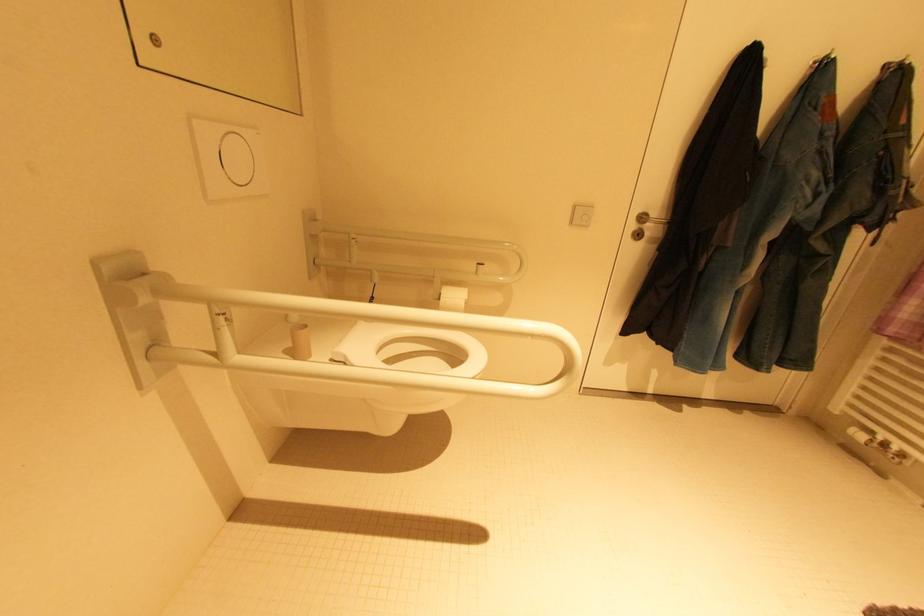
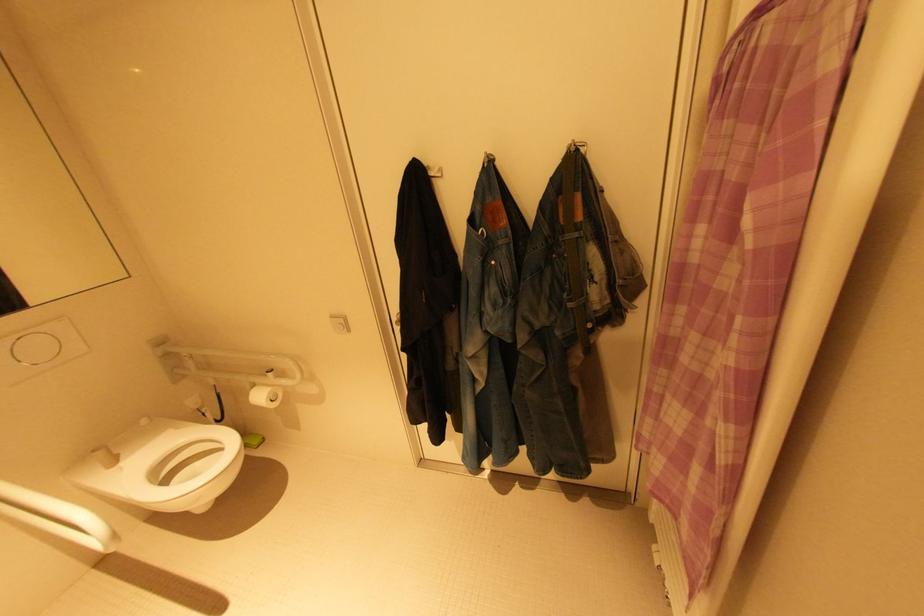
Question: The images are taken continuously from a first-person perspective. In which direction are you moving?

Choices:
 (A) Left
 (B) Right
 (C) Forward
 (D) Backward

Answer: (B)